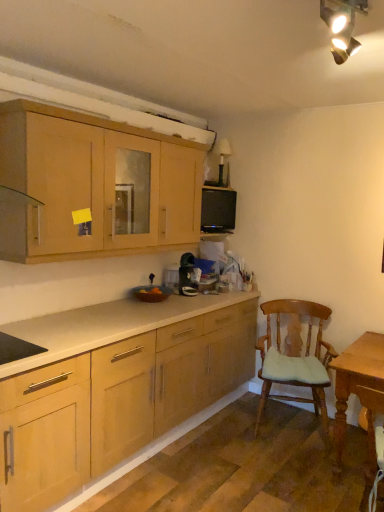
Question: Can you confirm if matte wood cabinets at upper left is smaller than black matte microwave at upper center?

Choices:
 (A) no
 (B) yes

Answer: (A)

Question: Can you confirm if matte wood cabinets at upper left is thinner than black matte microwave at upper center?

Choices:
 (A) yes
 (B) no

Answer: (B)

Question: Can you confirm if matte wood cabinets at upper left is shorter than black matte microwave at upper center?

Choices:
 (A) yes
 (B) no

Answer: (B)

Question: Is matte wood cabinets at upper left behind black matte microwave at upper center?

Choices:
 (A) yes
 (B) no

Answer: (B)

Question: Is matte wood cabinets at upper left closer to camera compared to black matte microwave at upper center?

Choices:
 (A) yes
 (B) no

Answer: (A)

Question: From a real-world perspective, is black matte microwave at upper center above or below wooden cushioned chair at right?

Choices:
 (A) above
 (B) below

Answer: (A)

Question: Is black matte microwave at upper center in front of or behind wooden cushioned chair at right in the image?

Choices:
 (A) behind
 (B) front

Answer: (A)

Question: In terms of height, does black matte microwave at upper center look taller or shorter compared to wooden cushioned chair at right?

Choices:
 (A) tall
 (B) short

Answer: (B)

Question: Is point (225, 228) positioned closer to the camera than point (281, 379)?

Choices:
 (A) farther
 (B) closer

Answer: (A)

Question: Looking at the image, does light brown wooden table at lower right seem bigger or smaller compared to matte wood cabinets at upper left?

Choices:
 (A) big
 (B) small

Answer: (B)

Question: In terms of width, does light brown wooden table at lower right look wider or thinner when compared to matte wood cabinets at upper left?

Choices:
 (A) wide
 (B) thin

Answer: (A)

Question: Is light brown wooden table at lower right in front of or behind matte wood cabinets at upper left in the image?

Choices:
 (A) behind
 (B) front

Answer: (A)

Question: In the image, is light brown wooden table at lower right on the left side or the right side of matte wood cabinets at upper left?

Choices:
 (A) right
 (B) left

Answer: (A)

Question: From a real-world perspective, relative to matte wood cabinets at upper left, is black matte microwave at upper center vertically above or below?

Choices:
 (A) below
 (B) above

Answer: (A)

Question: Is black matte microwave at upper center in front of or behind matte wood cabinets at upper left in the image?

Choices:
 (A) front
 (B) behind

Answer: (B)